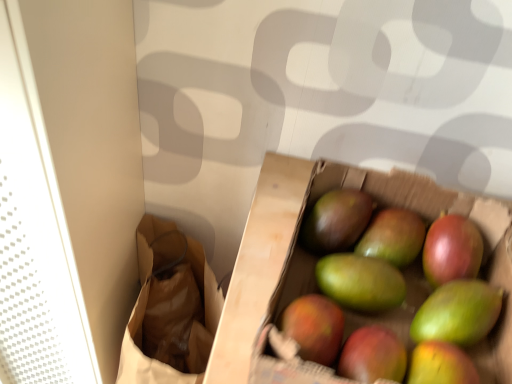
Question: Do you think green matte mango at center is within green matte mango at center, the 1th grapefruit viewed from the left, or outside of it?

Choices:
 (A) inside
 (B) outside

Answer: (A)

Question: Would you say green matte mango at center is to the left or to the right of green matte mango at center, the second grapefruit when ordered from right to left, in the picture?

Choices:
 (A) left
 (B) right

Answer: (A)

Question: Which object is the closest to the green matte mango at center?

Choices:
 (A) green matte mango at center
 (B) brown paper bag at left
 (C) shiny red grapefruit at center right, which is counted as the first grapefruit, starting from the right
 (D) green matte mango at center, the second grapefruit when ordered from right to left

Answer: (A)

Question: Which is nearer to the green matte mango at center?

Choices:
 (A) green matte mango at center
 (B) brown paper bag at left
 (C) green matte mango at center, the second grapefruit when ordered from right to left
 (D) shiny red grapefruit at center right, acting as the second grapefruit starting from the left

Answer: (A)